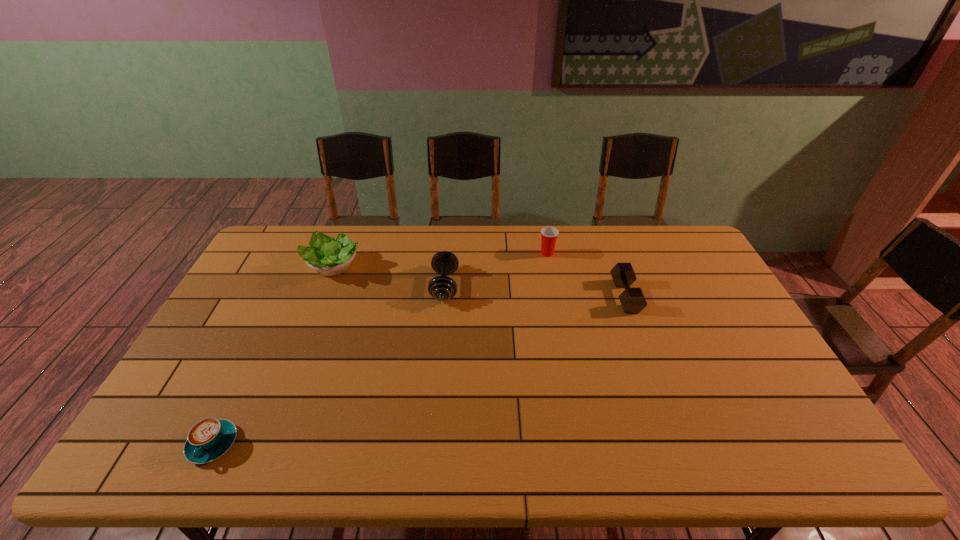
The height and width of the screenshot is (540, 960). In order to click on lettuce in this screenshot , I will do `click(328, 256)`.

What are the coordinates of `Dixie cup` in the screenshot? It's located at (549, 235).

Locate an element on the screen. The image size is (960, 540). the taller dumbbell is located at coordinates (442, 288).

Find the location of a particular element. The image size is (960, 540). the third object from left to right is located at coordinates (442, 288).

Locate an element on the screen. This screenshot has width=960, height=540. the shorter dumbbell is located at coordinates (632, 300).

You are a GUI agent. You are given a task and a screenshot of the screen. Output one action in this format:
    pyautogui.click(x=<x>, y=<y>)
    Task: Click on the second shortest object
    The image size is (960, 540).
    Given the screenshot: What is the action you would take?
    pyautogui.click(x=632, y=300)

Where is `the shortest object`? The image size is (960, 540). the shortest object is located at coordinates (210, 438).

You are a GUI agent. You are given a task and a screenshot of the screen. Output one action in this format:
    pyautogui.click(x=<x>, y=<y>)
    Task: Click on the nearest object
    Image resolution: width=960 pixels, height=540 pixels.
    Given the screenshot: What is the action you would take?
    pyautogui.click(x=210, y=438)

The image size is (960, 540). Find the location of `free space located on the front of the lettuce`. free space located on the front of the lettuce is located at coordinates (285, 388).

Find the location of `vacant space located 0.280m on the left of the Dixie cup`. vacant space located 0.280m on the left of the Dixie cup is located at coordinates (461, 253).